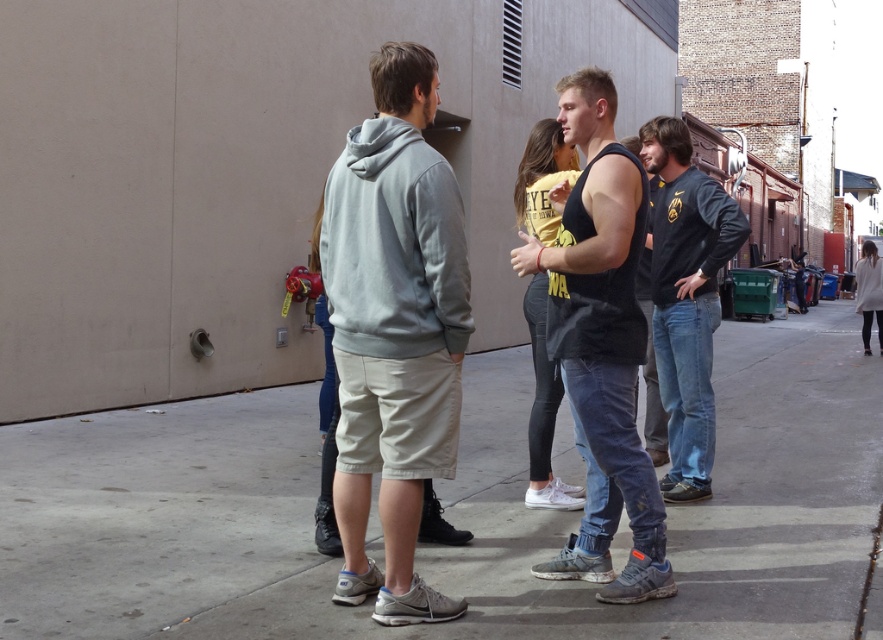
Based on the photo, you are a delivery person trying to place a package on the gray concrete pavement at center. The package is as wide as the light gray hoodie at center. Will the package fit on the pavement without overhanging?

The gray concrete pavement at center is wider than the light gray hoodie at center, so the package, which is as wide as the hoodie, will fit on the pavement without overhanging.

You are standing in an alleyway between two buildings. You see a point at coordinates (601, 344). What object is located at that point?

The point at coordinates (601, 344) indicates the black tank top at center.